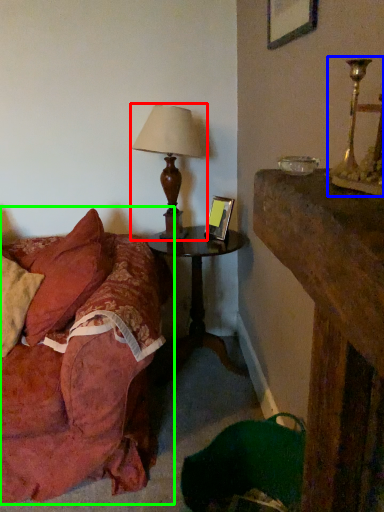
Question: Which object is positioned closest to lamp (highlighted by a red box)? Select from candle holder (highlighted by a blue box) and studio couch (highlighted by a green box).

Choices:
 (A) candle holder
 (B) studio couch

Answer: (B)